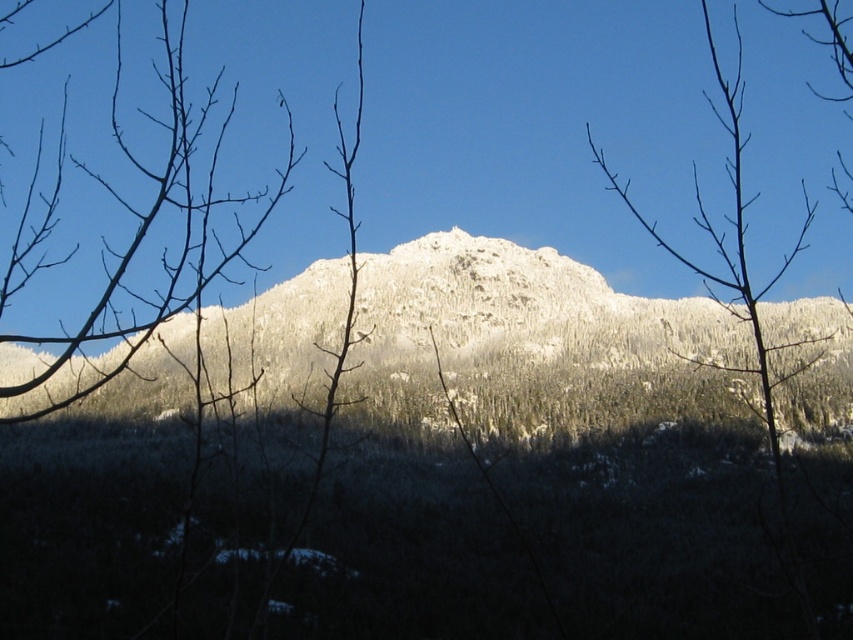
You are an artist sketching the landscape. You notice the white frosty mountain at center and the smooth bark tree at center. Which object is taller in the scene?

The smooth bark tree at center is taller than the white frosty mountain at center.

You are an outdoor photographer planning to capture the white frosty mountain at center and the smooth bark tree at center in a single shot. Based on their positions, which object should you focus on first to ensure both are in frame?

The smooth bark tree at center is positioned above the white frosty mountain at center, so focusing on the smooth bark tree at center first will help ensure both objects are within the camera frame.

You are an outdoor photographer positioned at the edge of the forest. You want to capture a photo that includes both the white frosty mountain at center and the smooth bark tree at center. Based on their positions, which object should you adjust your camera to focus on first to ensure both are in the frame?

Since the white frosty mountain at center is to the left of the smooth bark tree at center, you should adjust your camera to focus on the smooth bark tree at center first, as it is on the right side, ensuring there is enough space to include the mountain on the left in the frame.